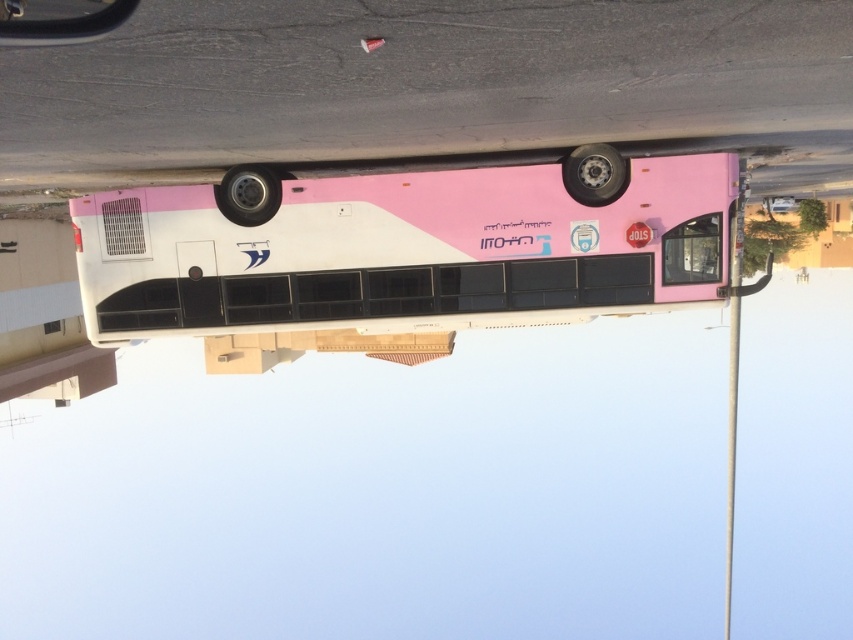
You are a passenger waiting to board the bus and see the pink matte bus at center and the metallic black view mirror at upper left. Which object is closer to your left side?

The metallic black view mirror at upper left is closer to your left side because the pink matte bus at center is positioned to the right of it.

You are a delivery person who needs to unload a package onto the pink matte bus at center. The metallic black view mirror at upper left is in your way. Can you move the mirror to the side to access the bus?

The pink matte bus at center is 38.63 feet away from the metallic black view mirror at upper left. Since the mirror is far from the bus, you can easily move the mirror aside to access the bus.

You are a delivery person trying to park your van next to the pink matte bus at center and the metallic black view mirror at upper left. Which object should you avoid hitting because it is wider?

The pink matte bus at center is wider than the metallic black view mirror at upper left, so you should avoid hitting the pink matte bus at center.